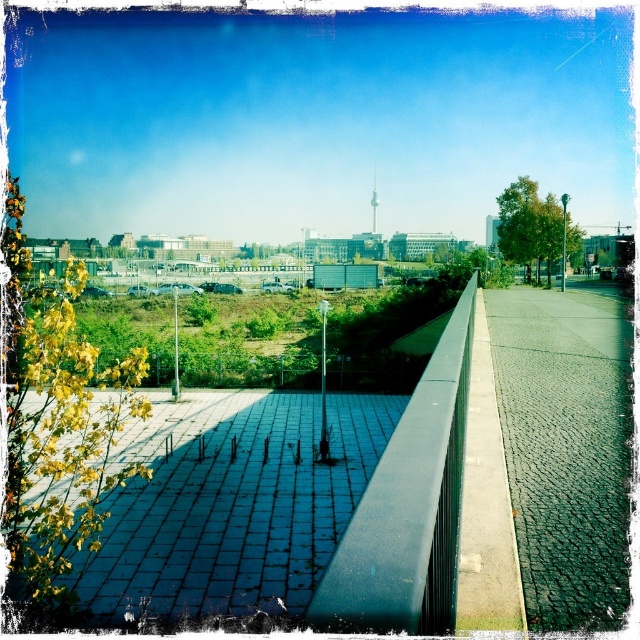
You are standing on the walkway and want to place a small potted plant between the dark gray paving stone at center and the white glass tv tower at center. Which object should the plant be closer to if you want it to be nearer to the viewer?

The plant should be placed closer to the dark gray paving stone at center because it is nearer to the viewer compared to the white glass tv tower at center.

In the scene shown: You are a maintenance worker checking the walkway and notice the cobblestone pavement at center and the black metal ledge at center. Which one has a higher elevation compared to the other?

The cobblestone pavement at center is much taller than the black metal ledge at center, so it has a higher elevation.

You are standing at the point marked by the coordinates point [566,448]. Looking around, you see cobblestone pavement at center. Which direction should you walk to reach the dark green metal railing on the right side of the walkway?

Since you are at the point marked by the coordinates point 0.700, 0886 and the cobblestone pavement at center is located there, you should walk to the right to reach the dark green metal railing on the right side of the walkway.